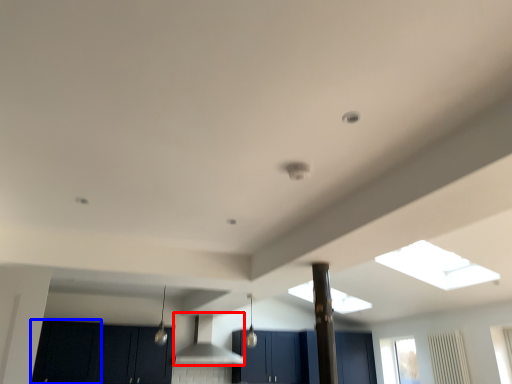
Question: Which of the following is the closest to the observer, vent (highlighted by a red box) or cabinetry (highlighted by a blue box)?

Choices:
 (A) vent
 (B) cabinetry

Answer: (B)